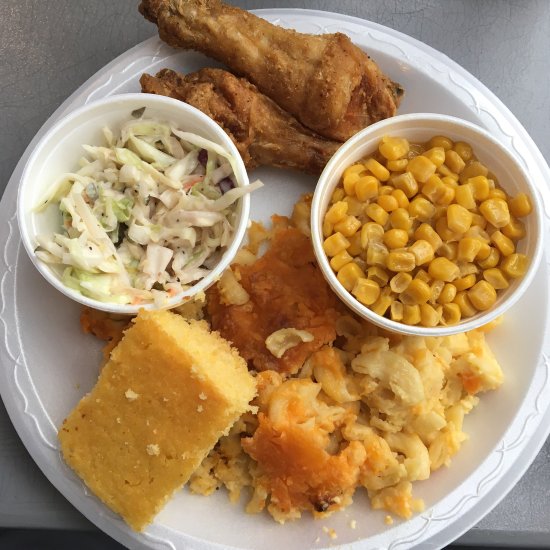
Find the location of `table`. table is located at coordinates (70, 31).